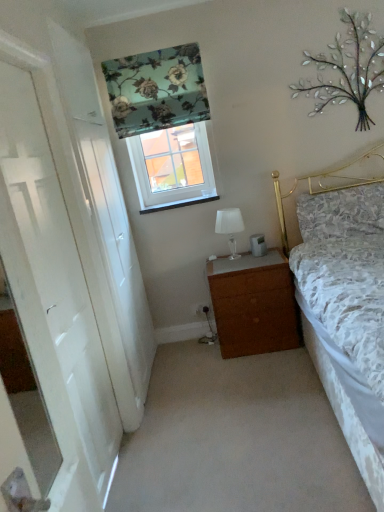
I want to click on free area in between white glossy door at left and brown wood chest of drawers at center, so click(x=198, y=396).